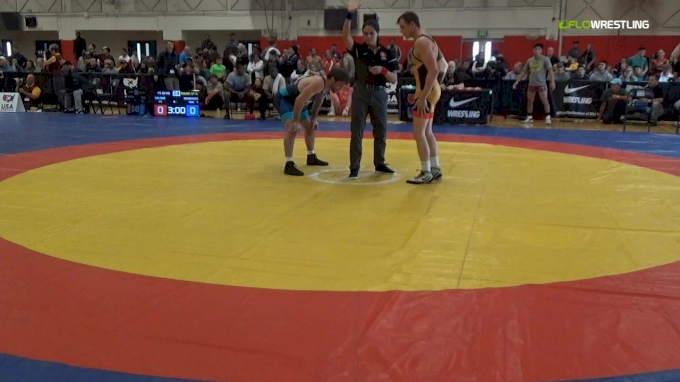
Identify the location of chairs. The width and height of the screenshot is (680, 382). (103, 100), (239, 107), (647, 114).